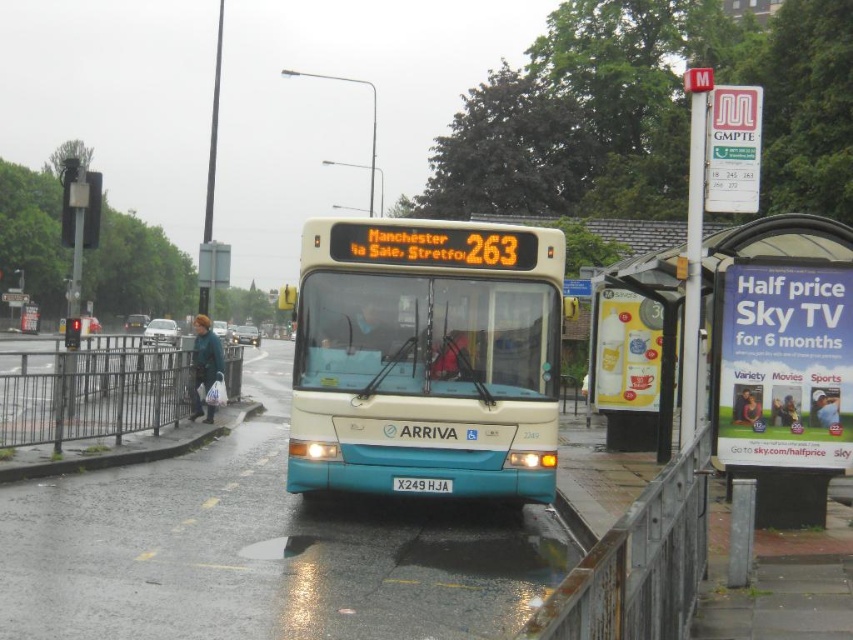
Question: Can you confirm if teal matte bus at center is smaller than gray concrete curb at lower left?

Choices:
 (A) no
 (B) yes

Answer: (A)

Question: Is teal matte bus at center smaller than gray concrete curb at lower left?

Choices:
 (A) no
 (B) yes

Answer: (A)

Question: Is teal matte bus at center positioned in front of gray concrete curb at lower left?

Choices:
 (A) yes
 (B) no

Answer: (A)